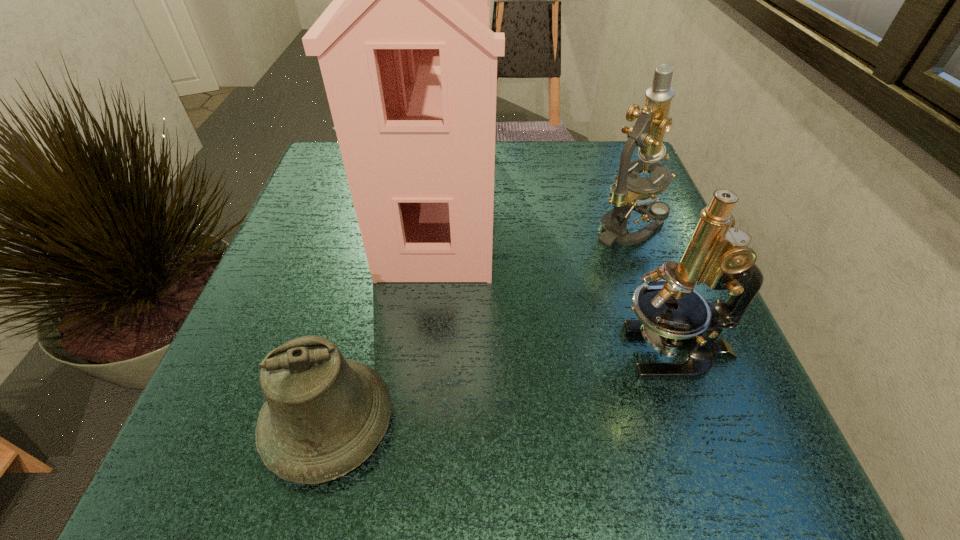
This screenshot has width=960, height=540. Find the location of `dollhouse`. dollhouse is located at coordinates (409, 63).

Locate an element on the screen. The width and height of the screenshot is (960, 540). the farther microscope is located at coordinates (630, 193).

Identify the location of the nearer microscope. Image resolution: width=960 pixels, height=540 pixels. (671, 314).

I want to click on the shortest object, so click(x=324, y=415).

I want to click on vacant area located on the front-facing side of the dollhouse, so click(582, 201).

The width and height of the screenshot is (960, 540). Find the location of `free space located 0.150m on the back of the farther microscope`. free space located 0.150m on the back of the farther microscope is located at coordinates (607, 167).

The width and height of the screenshot is (960, 540). In order to click on vacant space located at the eyepiece of the nearer microscope in this screenshot , I will do `click(550, 352)`.

Locate an element on the screen. The width and height of the screenshot is (960, 540). free space located 0.380m at the eyepiece of the nearer microscope is located at coordinates (369, 352).

Locate an element on the screen. The height and width of the screenshot is (540, 960). blank area located 0.080m at the eyepiece of the nearer microscope is located at coordinates (564, 352).

Where is `vacant area located on the back of the shortest object`? vacant area located on the back of the shortest object is located at coordinates (367, 272).